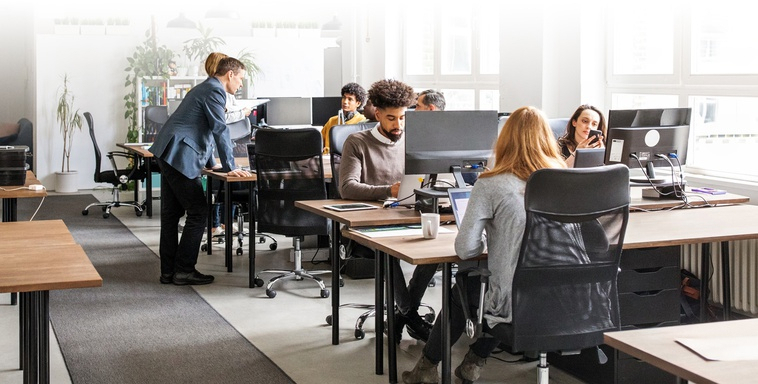
At what (x,y) coordinates should I click in order to perform the action: click on plant. Please return your answer as a coordinate pair (x, y). The width and height of the screenshot is (758, 384). Looking at the image, I should click on (61, 165), (152, 56), (195, 46), (251, 64).